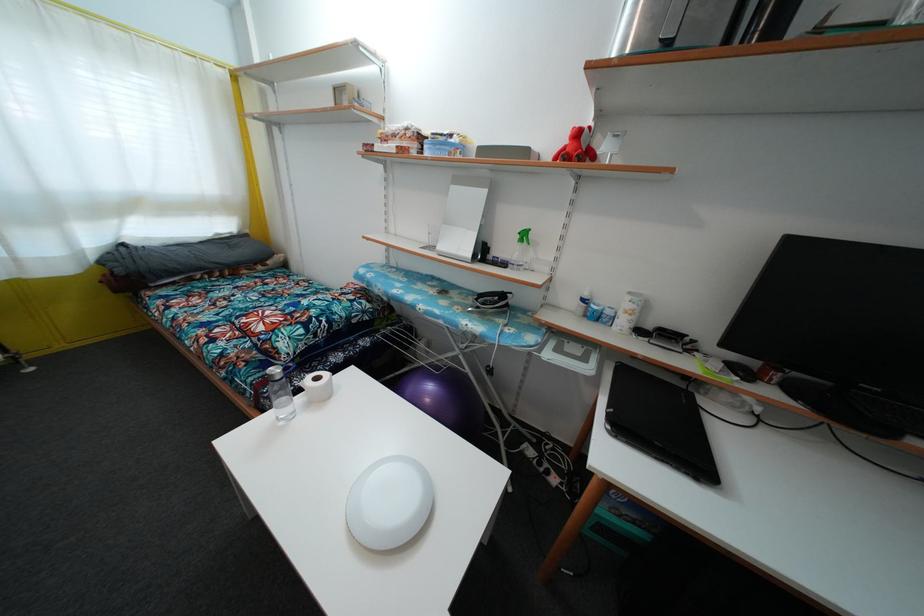
Find where to lift the white circular light. Please return your answer as a coordinate pair (x, y).

(388, 503)